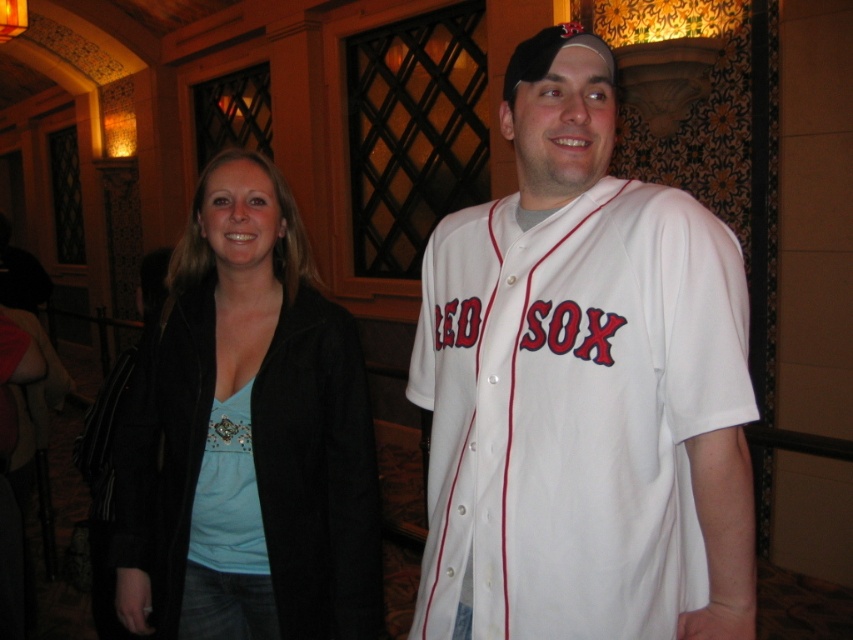
You are a photographer setting up for a group photo. You notice the white jersey at center and the matte black jacket at center in the frame. Which clothing item is covering part of the other?

The white jersey at center is positioned over the matte black jacket at center, so it is covering part of the matte black jacket at center.

In the scene shown: You are standing in front of the two people in the image. You want to hand a gift to the person wearing the white jersey at center without accidentally giving it to the person in the matte black jacket at center. How can you ensure you give the gift to the correct person?

The white jersey at center is closer to the viewer than the matte black jacket at center. To ensure you give the gift to the correct person, extend your hand toward the white jersey at center, which is nearer to you compared to the matte black jacket at center.

In the scene shown: You are taking a photo of the two points in the image. Which point is closer to the camera, point 1 at position (668, 451) or point 2 at position (200, 276)?

Point 1 at position (668, 451) is closer to the camera than point 2 at position (200, 276).